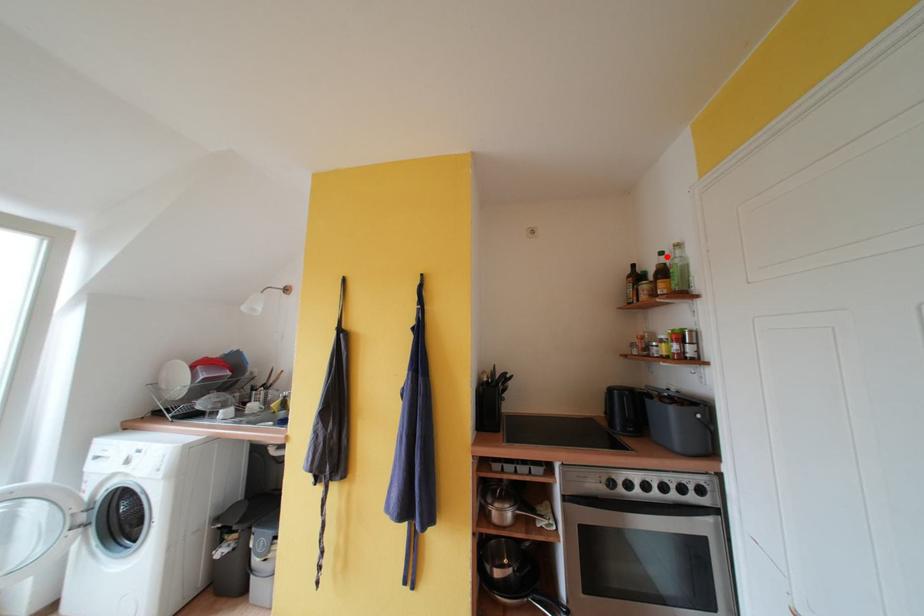
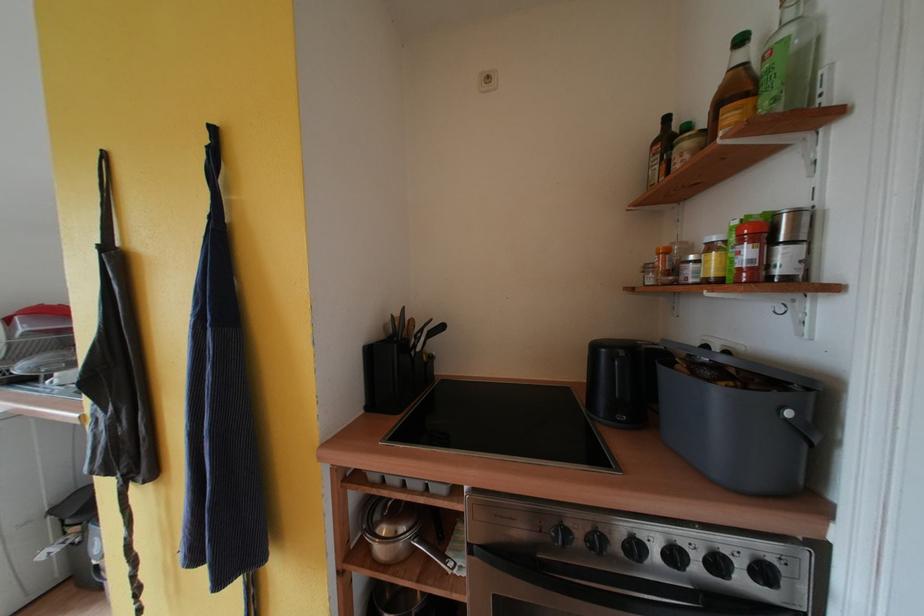
Where in the second image is the point corresponding to the highlighted location from the first image?

(748, 44)